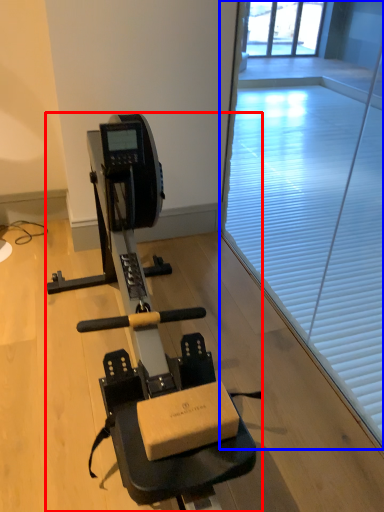
Question: Which object is closer to the camera taking this photo, stationary bicycle (highlighted by a red box) or window screen (highlighted by a blue box)?

Choices:
 (A) stationary bicycle
 (B) window screen

Answer: (A)